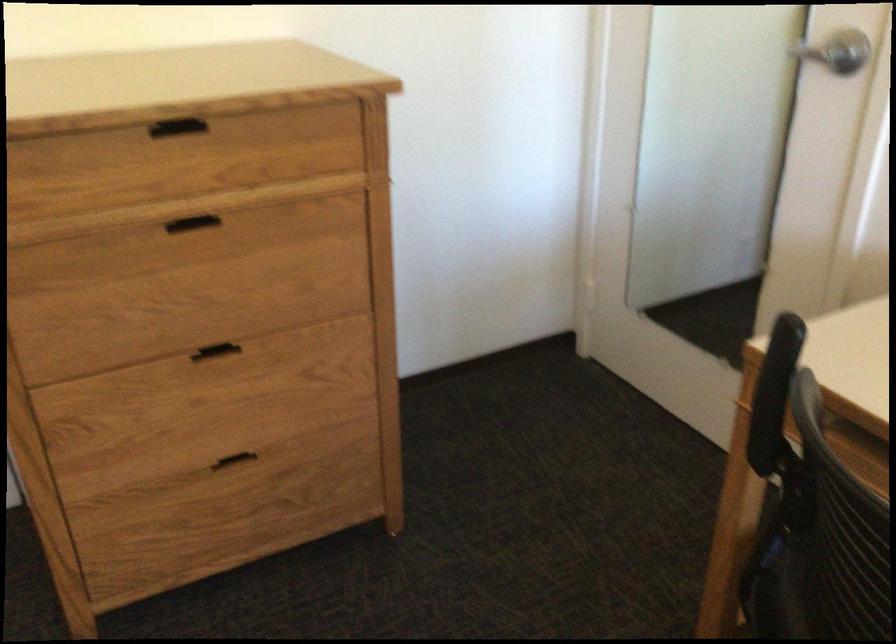
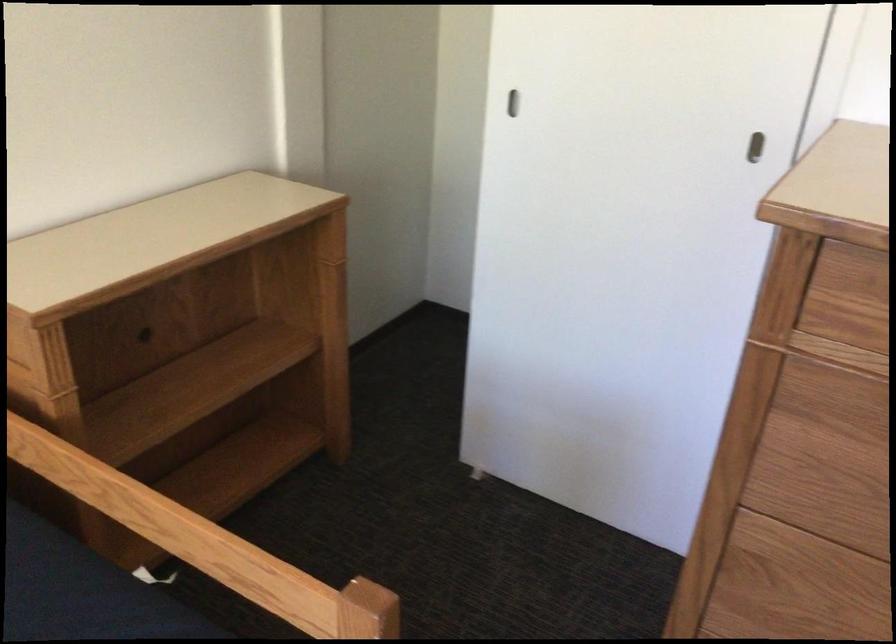
Question: The images are taken continuously from a first-person perspective. In which direction is your viewpoint rotating?

Choices:
 (A) Left
 (B) Right
 (C) Up
 (D) Down

Answer: (A)